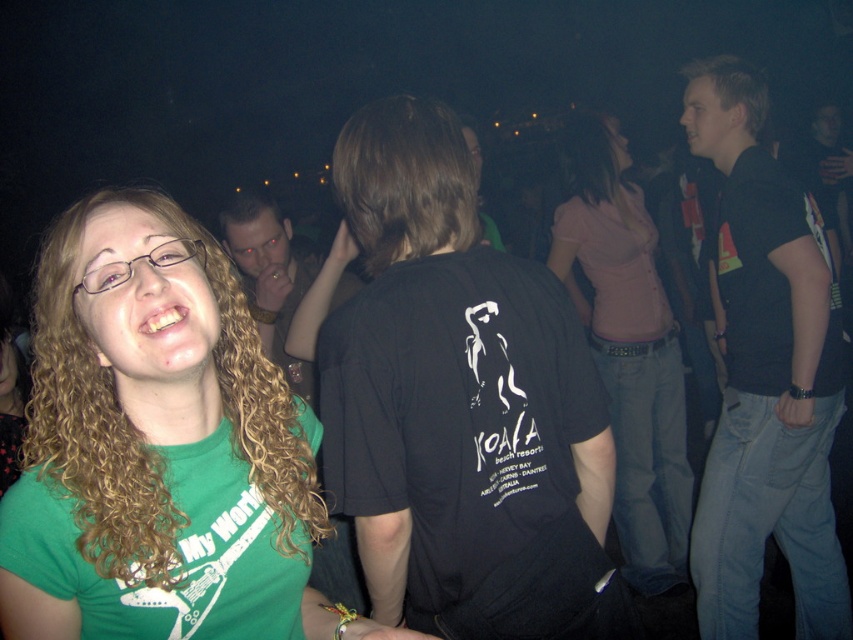
Which is more to the left, brown matte hair at center or matte black shirt at center?

Positioned to the left is matte black shirt at center.

Can you confirm if brown matte hair at center is positioned to the left of matte black shirt at center?

In fact, brown matte hair at center is to the right of matte black shirt at center.

Does point (444, 189) come behind point (276, 310)?

No, it is not.

The image size is (853, 640). I want to click on brown matte hair at center, so click(x=405, y=180).

Is green matte t-shirt at center below brown matte hair at center?

Yes.

Does green matte t-shirt at center have a larger size compared to brown matte hair at center?

Correct, green matte t-shirt at center is larger in size than brown matte hair at center.

The image size is (853, 640). Identify the location of green matte t-shirt at center. (155, 444).

How much distance is there between green matte t-shirt at center and pink fabric shirt at center?

They are 2.19 meters apart.

Looking at this image, can you confirm if green matte t-shirt at center is smaller than pink fabric shirt at center?

Yes, green matte t-shirt at center is smaller than pink fabric shirt at center.

This screenshot has width=853, height=640. I want to click on green matte t-shirt at center, so click(155, 444).